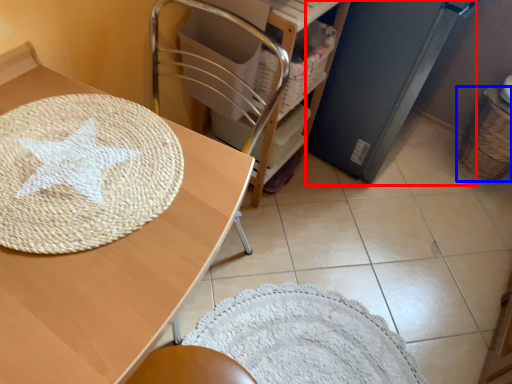
Question: Which of the following is the farthest to the observer, appliance (highlighted by a red box) or basket (highlighted by a blue box)?

Choices:
 (A) appliance
 (B) basket

Answer: (B)